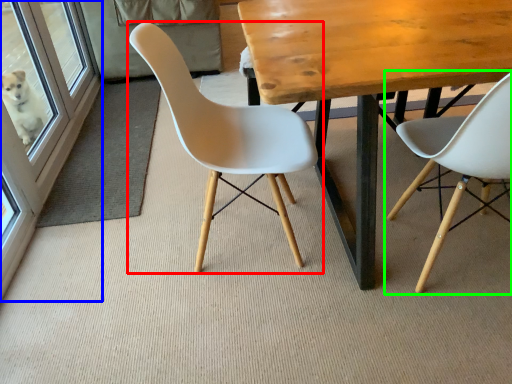
Question: Estimate the real-world distances between objects in this image. Which object is farther from chair (highlighted by a red box), screen door (highlighted by a blue box) or chair (highlighted by a green box)?

Choices:
 (A) screen door
 (B) chair

Answer: (A)